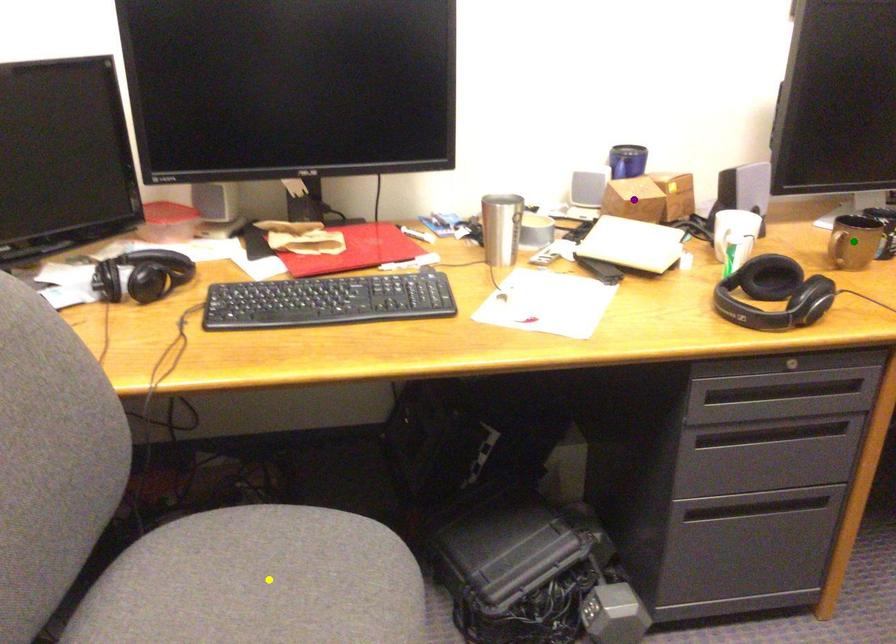
Order these from nearest to farthest:
- yellow point
- purple point
- green point

purple point → green point → yellow point